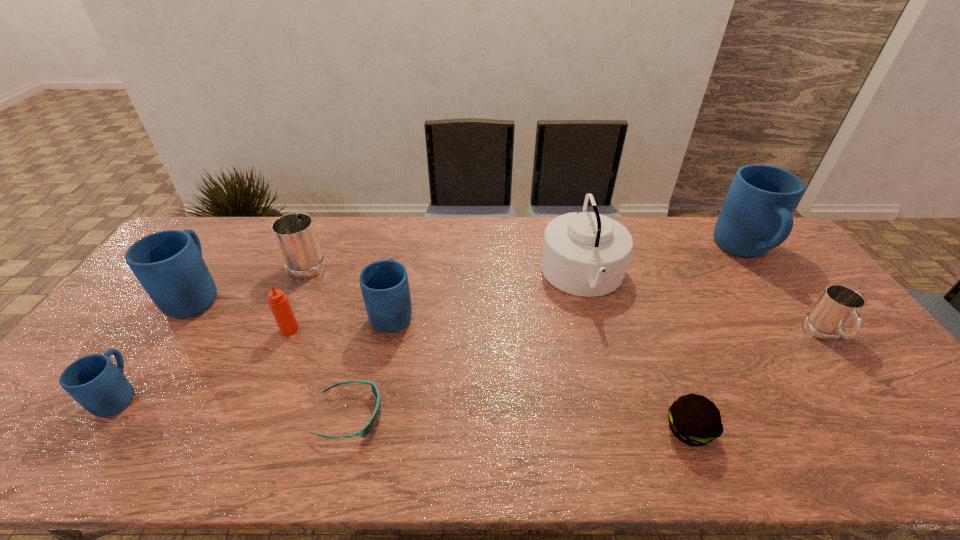
Where is `free spot between the smaller gray mug and the Tabasco sauce`? The width and height of the screenshot is (960, 540). free spot between the smaller gray mug and the Tabasco sauce is located at coordinates (558, 332).

Where is `object that can be found as the eighth closest to the nearer gray mug`? object that can be found as the eighth closest to the nearer gray mug is located at coordinates (168, 264).

Identify the location of object that can be found as the fourth closest to the left gray mug. (94, 381).

Identify the location of the second closest mug to the ninth tallest object. (755, 217).

Image resolution: width=960 pixels, height=540 pixels. In order to click on mug that is the fourth closest to the third smallest blue mug in this screenshot , I will do `click(755, 217)`.

The width and height of the screenshot is (960, 540). What are the coordinates of `the second closest blue mug relative to the third mug from right to left` in the screenshot? It's located at (94, 381).

Identify which blue mug is the fourth nearest to the cyan sunglasses. Please provide its 2D coordinates. Your answer should be formatted as a tuple, i.e. [(x, y)], where the tuple contains the x and y coordinates of a point satisfying the conditions above.

[(755, 217)]